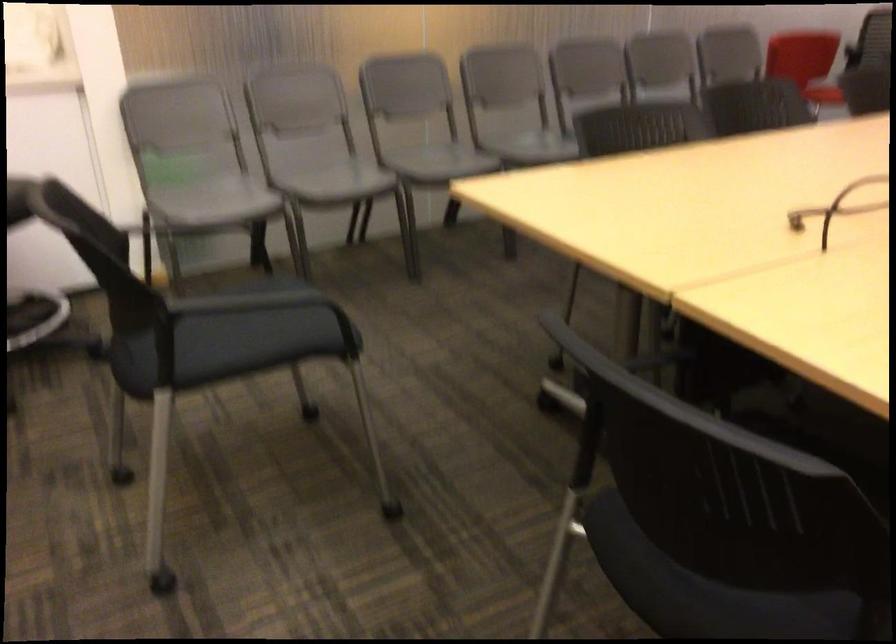
Locate an element on the screen. The height and width of the screenshot is (644, 896). black chair sitting surface is located at coordinates (235, 336).